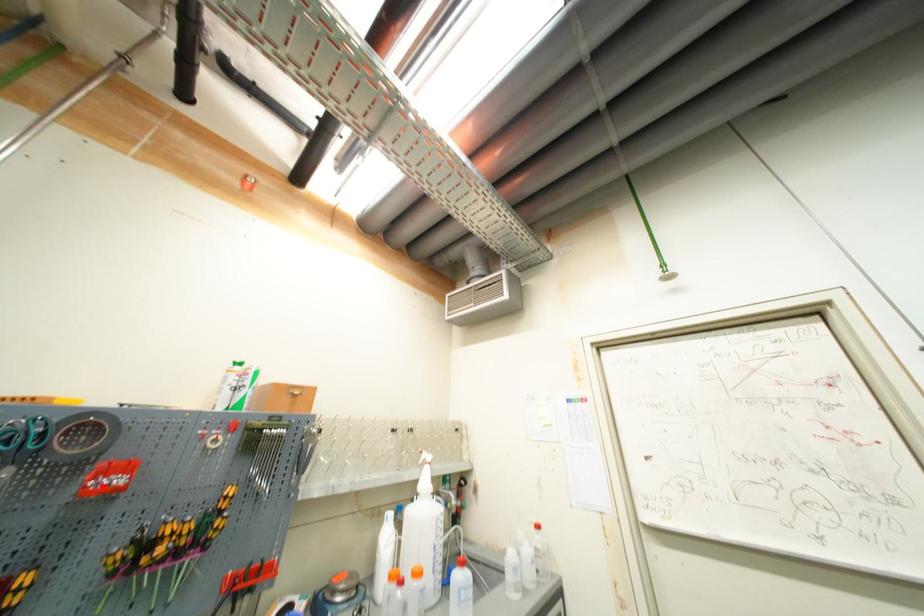
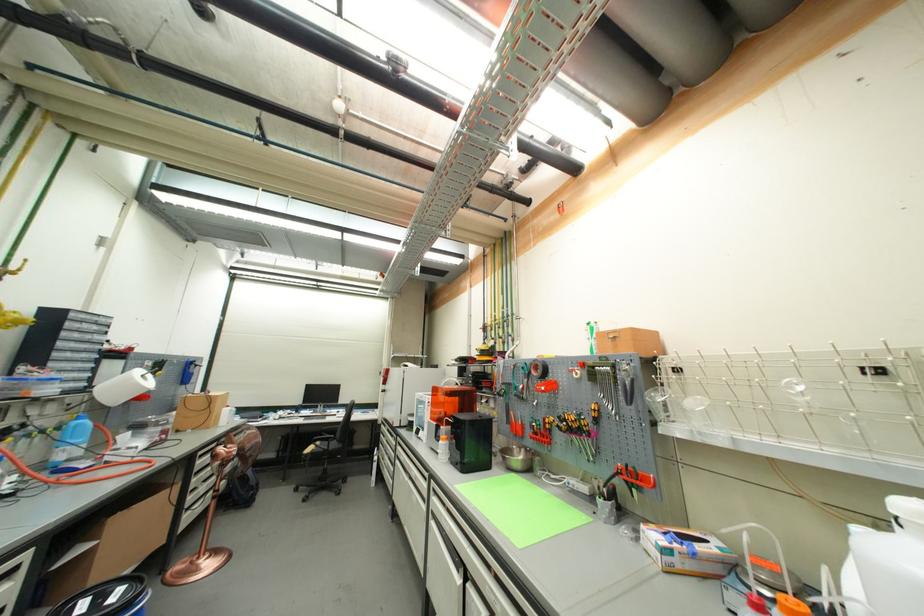
Locate, in the second image, the point that corresponds to the highlighted location in the first image.

(544, 390)